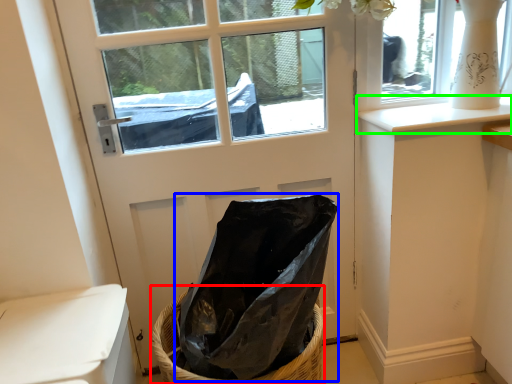
Question: Considering the real-world distances, which object is farthest from basket (highlighted by a red box)? bag (highlighted by a blue box) or window sill (highlighted by a green box)?

Choices:
 (A) bag
 (B) window sill

Answer: (B)